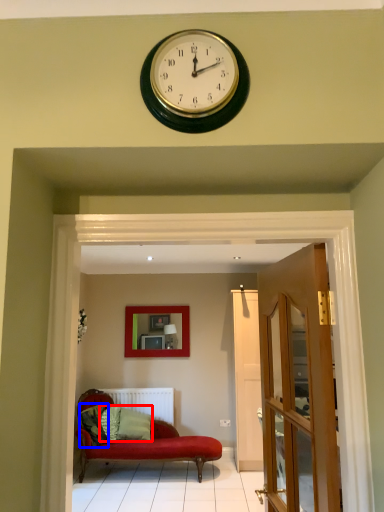
Question: Which object appears farthest to the camera in this image, pillow (highlighted by a red box) or pillow (highlighted by a blue box)?

Choices:
 (A) pillow
 (B) pillow

Answer: (A)